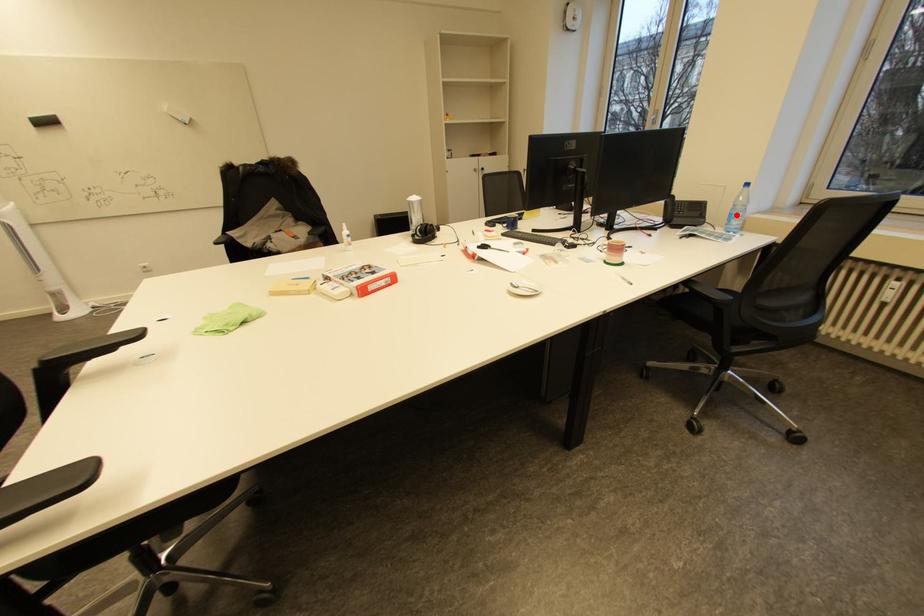
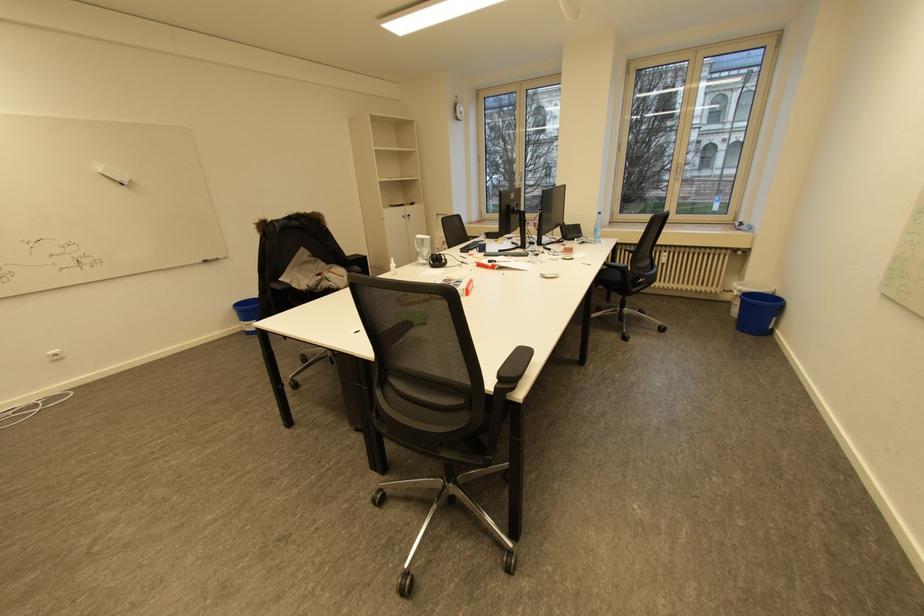
In the second image, find the point that corresponds to the highlighted location in the first image.

(601, 230)